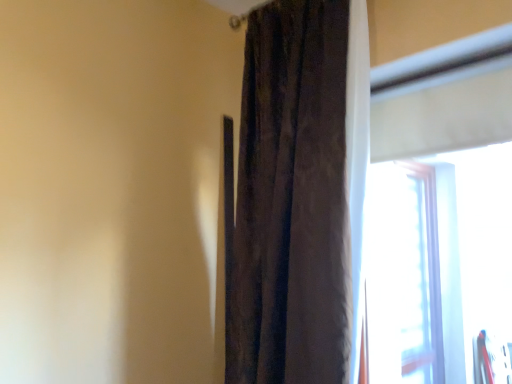
Describe the element at coordinates (438, 210) in the screenshot. I see `transparent plastic window at right` at that location.

Identify the location of transparent plastic window at right. (438, 210).

This screenshot has height=384, width=512. What do you see at coordinates (291, 200) in the screenshot?
I see `velvet brown curtain at center` at bounding box center [291, 200].

This screenshot has width=512, height=384. I want to click on velvet brown curtain at center, so click(291, 200).

Image resolution: width=512 pixels, height=384 pixels. Find the location of `transparent plastic window at right`. transparent plastic window at right is located at coordinates (438, 210).

Which is more to the right, velvet brown curtain at center or transparent plastic window at right?

From the viewer's perspective, transparent plastic window at right appears more on the right side.

Is the position of velvet brown curtain at center less distant than that of transparent plastic window at right?

No, it is not.

Which is in front, point (314, 209) or point (368, 314)?

The point (314, 209) is closer.

In the scene shown: From the image's perspective, is velvet brown curtain at center located above or below transparent plastic window at right?

Based on their image positions, velvet brown curtain at center is located above transparent plastic window at right.

From a real-world perspective, is velvet brown curtain at center positioned under transparent plastic window at right based on gravity?

Actually, velvet brown curtain at center is physically above transparent plastic window at right in the real world.

Which object is wider, velvet brown curtain at center or transparent plastic window at right?

→ Wider between the two is velvet brown curtain at center.

Does velvet brown curtain at center have a greater height compared to transparent plastic window at right?

Yes, velvet brown curtain at center is taller than transparent plastic window at right.

Does velvet brown curtain at center have a larger size compared to transparent plastic window at right?

Yes, velvet brown curtain at center is bigger than transparent plastic window at right.

Is velvet brown curtain at center spatially inside transparent plastic window at right, or outside of it?

velvet brown curtain at center cannot be found inside transparent plastic window at right.

Is velvet brown curtain at center beside transparent plastic window at right?

No, velvet brown curtain at center is not next to transparent plastic window at right.

Is velvet brown curtain at center turned away from transparent plastic window at right?

No, transparent plastic window at right is not at the back of velvet brown curtain at center.

How different are the orientations of velvet brown curtain at center and transparent plastic window at right in degrees?

They differ by 0.616 degrees in their facing directions.

How much distance is there between velvet brown curtain at center and transparent plastic window at right?

velvet brown curtain at center and transparent plastic window at right are 2.03 meters apart.

You are a GUI agent. You are given a task and a screenshot of the screen. Output one action in this format:
    pyautogui.click(x=<x>, y=<y>)
    Task: Click on the window lying on the right of velvet brown curtain at center
    Image resolution: width=512 pixels, height=384 pixels.
    Given the screenshot: What is the action you would take?
    pyautogui.click(x=438, y=210)

Visually, is transparent plastic window at right positioned to the left or to the right of velvet brown curtain at center?

transparent plastic window at right is positioned on velvet brown curtain at center's right side.

Is transparent plastic window at right positioned before velvet brown curtain at center?

Yes, it is.

Is point (371, 200) positioned in front of point (293, 79)?

No, it is behind (293, 79).

From the image's perspective, between transparent plastic window at right and velvet brown curtain at center, who is located below?

transparent plastic window at right appears lower in the image.

From a real-world perspective, does transparent plastic window at right stand above velvet brown curtain at center?

Actually, transparent plastic window at right is physically below velvet brown curtain at center in the real world.

Considering the sizes of transparent plastic window at right and velvet brown curtain at center in the image, is transparent plastic window at right wider or thinner than velvet brown curtain at center?

transparent plastic window at right is thinner than velvet brown curtain at center.

Considering the relative sizes of transparent plastic window at right and velvet brown curtain at center in the image provided, is transparent plastic window at right taller than velvet brown curtain at center?

No, transparent plastic window at right is not taller than velvet brown curtain at center.

Based on their sizes in the image, would you say transparent plastic window at right is bigger or smaller than velvet brown curtain at center?

Clearly, transparent plastic window at right is smaller in size than velvet brown curtain at center.

Is velvet brown curtain at center completely or partially inside transparent plastic window at right?

No, velvet brown curtain at center is not surrounded by transparent plastic window at right.

Are transparent plastic window at right and velvet brown curtain at center making contact?

No, transparent plastic window at right is not next to velvet brown curtain at center.

Is transparent plastic window at right positioned with its back to velvet brown curtain at center?

No, transparent plastic window at right is not facing away from velvet brown curtain at center.

Locate an element on the screen. This screenshot has width=512, height=384. curtain above the transparent plastic window at right (from the image's perspective) is located at coordinates (291, 200).

The image size is (512, 384). In order to click on curtain on the left side of transparent plastic window at right in this screenshot , I will do `click(291, 200)`.

You are a GUI agent. You are given a task and a screenshot of the screen. Output one action in this format:
    pyautogui.click(x=<x>, y=<y>)
    Task: Click on the curtain behind the transparent plastic window at right
    
    Given the screenshot: What is the action you would take?
    pyautogui.click(x=291, y=200)